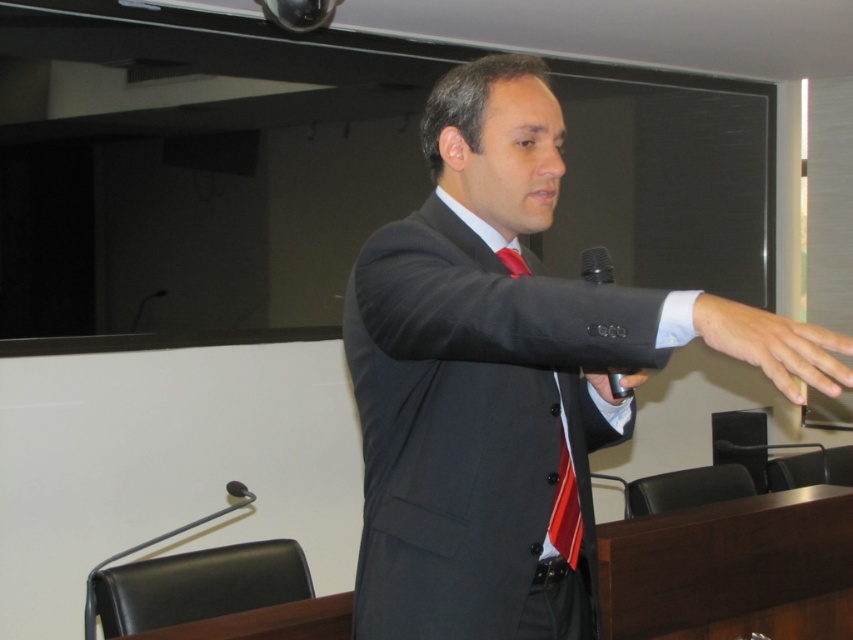
Is smooth skin hand at right shorter than black metallic microphone at lower left?

Incorrect, smooth skin hand at right's height does not fall short of black metallic microphone at lower left's.

Does smooth skin hand at right have a greater width compared to black metallic microphone at lower left?

Yes, smooth skin hand at right is wider than black metallic microphone at lower left.

Which is in front, point (811, 356) or point (247, 490)?

Point (811, 356) is more forward.

Image resolution: width=853 pixels, height=640 pixels. I want to click on smooth skin hand at right, so click(775, 346).

Does matte black suit at center have a larger size compared to metallic silver microphone at center?

Yes.

Between matte black suit at center and metallic silver microphone at center, which one is positioned lower?

matte black suit at center is lower down.

Where is `matte black suit at center`? The image size is (853, 640). matte black suit at center is located at coordinates (508, 378).

Can you confirm if red striped tie at center is positioned below metallic silver microphone at center?

Indeed, red striped tie at center is positioned under metallic silver microphone at center.

Consider the image. Can you confirm if red striped tie at center is shorter than metallic silver microphone at center?

Correct, red striped tie at center is not as tall as metallic silver microphone at center.

The width and height of the screenshot is (853, 640). What are the coordinates of `red striped tie at center` in the screenshot? It's located at (566, 509).